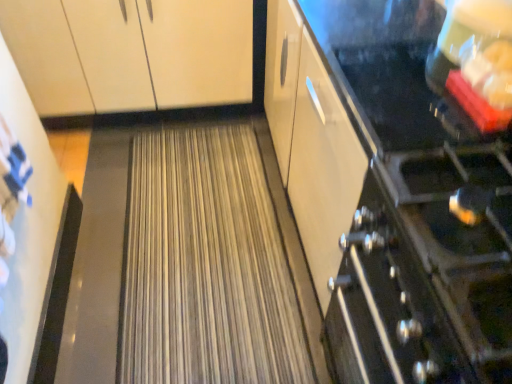
Question: Relative to matte white cabinet at upper left, is satin black stove at right in front or behind?

Choices:
 (A) behind
 (B) front

Answer: (B)

Question: Is point (488, 231) closer or farther from the camera than point (41, 100)?

Choices:
 (A) closer
 (B) farther

Answer: (A)

Question: In terms of width, does satin black stove at right look wider or thinner when compared to matte white cabinet at upper left?

Choices:
 (A) wide
 (B) thin

Answer: (B)

Question: In the image, is matte white cabinet at upper left positioned in front of or behind satin black stove at right?

Choices:
 (A) front
 (B) behind

Answer: (B)

Question: From the image's perspective, is matte white cabinet at upper left positioned above or below satin black stove at right?

Choices:
 (A) above
 (B) below

Answer: (A)

Question: In terms of height, does matte white cabinet at upper left look taller or shorter compared to satin black stove at right?

Choices:
 (A) short
 (B) tall

Answer: (A)

Question: In the image, is matte white cabinet at upper left on the left side or the right side of satin black stove at right?

Choices:
 (A) right
 (B) left

Answer: (B)